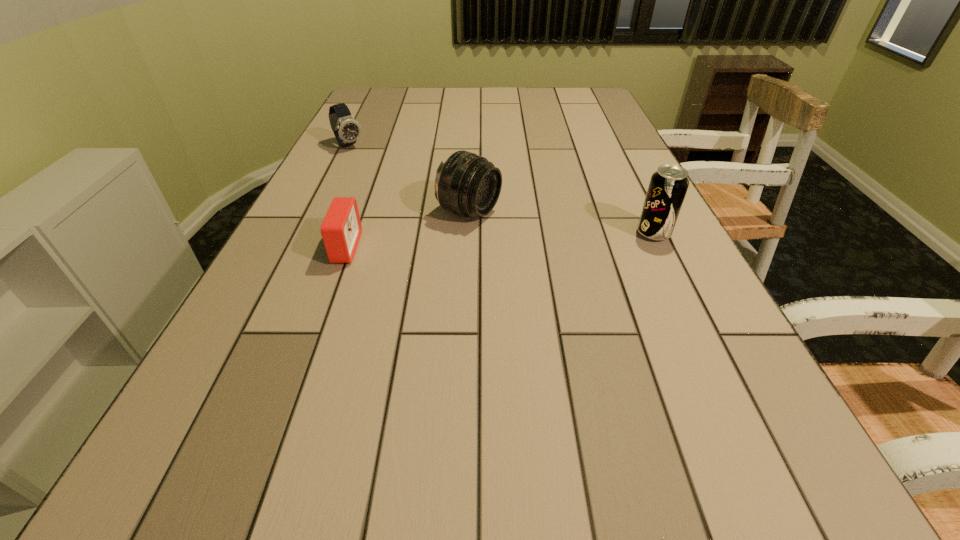
Locate an element on the screen. vacant space on the desktop that is between the shortest object and the soda can and is positioned on the face of the second shortest object is located at coordinates (463, 242).

Find the location of `free space on the desktop that is between the second object from left to right and the rightmost object and is positioned at the front element of the second object from right to left`. free space on the desktop that is between the second object from left to right and the rightmost object and is positioned at the front element of the second object from right to left is located at coordinates [543, 239].